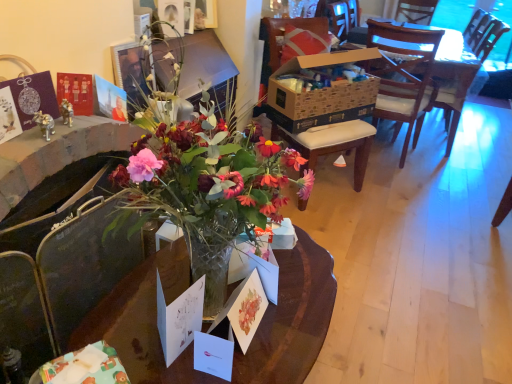
Question: Is wooden armchair at center bigger than matte paper postcard at center, which appears as the 1th postcard when viewed from the right?

Choices:
 (A) no
 (B) yes

Answer: (B)

Question: Is wooden armchair at center oriented away from matte paper postcard at center, the third postcard when ordered from left to right?

Choices:
 (A) yes
 (B) no

Answer: (B)

Question: From the image's perspective, is wooden armchair at center below matte paper postcard at center, the third postcard when ordered from left to right?

Choices:
 (A) no
 (B) yes

Answer: (A)

Question: Does wooden armchair at center have a greater height compared to matte paper postcard at center, which appears as the 1th postcard when viewed from the right?

Choices:
 (A) yes
 (B) no

Answer: (A)

Question: Is wooden armchair at center to the right of matte paper postcard at center, the third postcard when ordered from left to right, from the viewer's perspective?

Choices:
 (A) yes
 (B) no

Answer: (A)

Question: From a real-world perspective, does wooden armchair at center stand above matte paper postcard at center, which appears as the 1th postcard when viewed from the right?

Choices:
 (A) no
 (B) yes

Answer: (B)

Question: Is translucent glass vase at center outside matte wooden picture frame at upper center?

Choices:
 (A) yes
 (B) no

Answer: (A)

Question: From a real-world perspective, is translucent glass vase at center on top of matte wooden picture frame at upper center?

Choices:
 (A) yes
 (B) no

Answer: (B)

Question: Is translucent glass vase at center beside matte wooden picture frame at upper center?

Choices:
 (A) no
 (B) yes

Answer: (A)

Question: Could you tell me if translucent glass vase at center is facing matte wooden picture frame at upper center?

Choices:
 (A) yes
 (B) no

Answer: (B)

Question: Considering the relative sizes of translucent glass vase at center and matte wooden picture frame at upper center in the image provided, is translucent glass vase at center shorter than matte wooden picture frame at upper center?

Choices:
 (A) no
 (B) yes

Answer: (A)

Question: Does translucent glass vase at center have a lesser width compared to matte wooden picture frame at upper center?

Choices:
 (A) no
 (B) yes

Answer: (A)

Question: Is the position of white paper postcard at center, marked as the 3th postcard in a right-to-left arrangement, more distant than that of matte paper postcard at center, the third postcard when ordered from left to right?

Choices:
 (A) no
 (B) yes

Answer: (A)